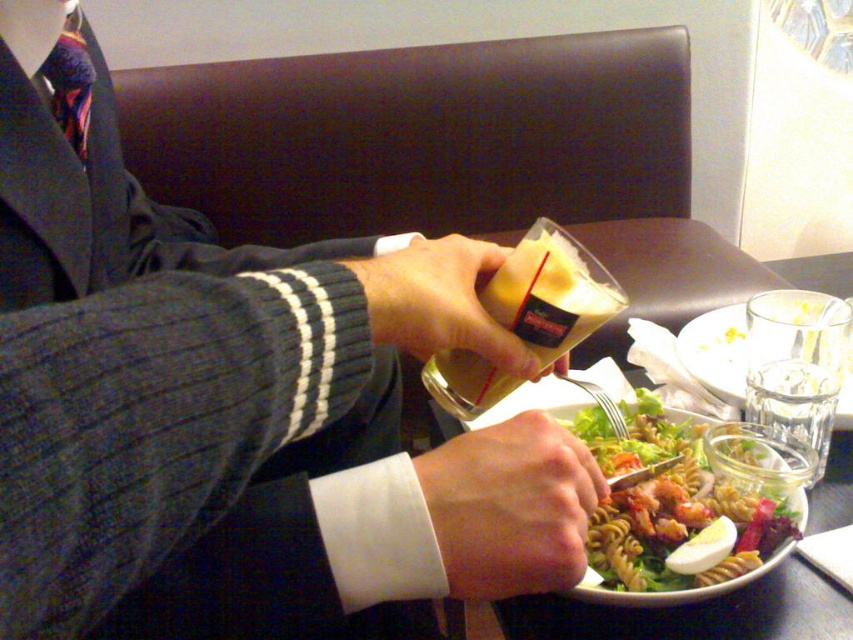
Question: Does translucent plastic bottle at center come in front of matte plastic salad bowl at center?

Choices:
 (A) no
 (B) yes

Answer: (B)

Question: Which object is positioned farthest from the white matte hand at lower center?

Choices:
 (A) matte plastic cup at center
 (B) green matte pasta salad at center
 (C) matte plastic salad bowl at center
 (D) translucent plastic bottle at center

Answer: (C)

Question: Which object is farther from the camera taking this photo?

Choices:
 (A) white matte hand at lower center
 (B) matte plastic cup at center

Answer: (A)

Question: Does green matte pasta salad at center appear under matte plastic salad bowl at center?

Choices:
 (A) no
 (B) yes

Answer: (B)

Question: Is translucent plastic bottle at center positioned at the back of matte plastic cup at center?

Choices:
 (A) yes
 (B) no

Answer: (B)

Question: Which of the following is the closest to the observer?

Choices:
 (A) (753, 524)
 (B) (206, 364)
 (C) (369, 310)

Answer: (B)